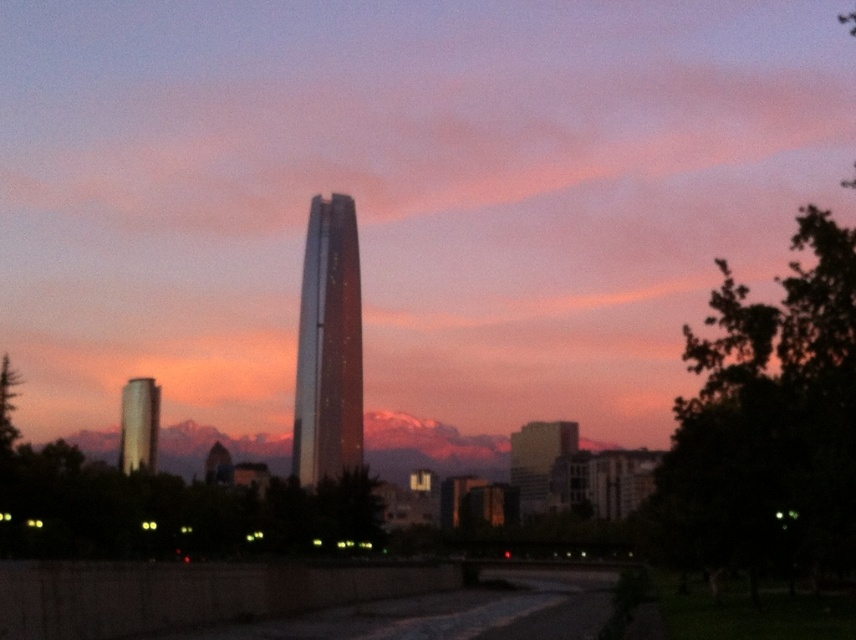
Does glossy glass tower at center have a greater height compared to shiny glass tower at center?

Indeed, glossy glass tower at center has a greater height compared to shiny glass tower at center.

In the scene shown: Does glossy glass tower at center appear on the left side of shiny glass tower at center?

Incorrect, glossy glass tower at center is not on the left side of shiny glass tower at center.

You are a GUI agent. You are given a task and a screenshot of the screen. Output one action in this format:
    pyautogui.click(x=<x>, y=<y>)
    Task: Click on the glossy glass tower at center
    
    Given the screenshot: What is the action you would take?
    pyautogui.click(x=402, y=195)

Between glossy glass tower at center and smooth glass building at center, which one has less height?

Standing shorter between the two is smooth glass building at center.

Describe the element at coordinates (402, 195) in the screenshot. I see `glossy glass tower at center` at that location.

Is point (262, 364) behind point (553, 432)?

Yes.

You are a GUI agent. You are given a task and a screenshot of the screen. Output one action in this format:
    pyautogui.click(x=<x>, y=<y>)
    Task: Click on the glossy glass tower at center
    The width and height of the screenshot is (856, 640).
    Given the screenshot: What is the action you would take?
    pyautogui.click(x=402, y=195)

Between smooth glass building at center and shiny silver tower at left, which one appears on the left side from the viewer's perspective?

shiny silver tower at left

Who is taller, smooth glass building at center or shiny silver tower at left?

shiny silver tower at left is taller.

The height and width of the screenshot is (640, 856). Describe the element at coordinates (538, 460) in the screenshot. I see `smooth glass building at center` at that location.

Locate an element on the screen. This screenshot has width=856, height=640. smooth glass building at center is located at coordinates (538, 460).